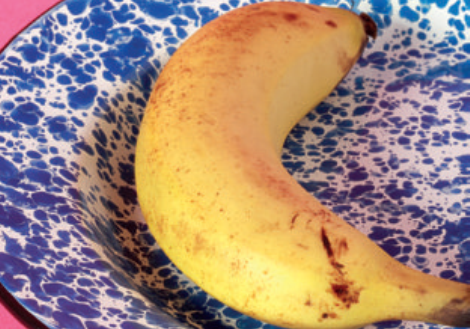
Where is `plate rim`? This screenshot has width=470, height=329. plate rim is located at coordinates (16, 35).